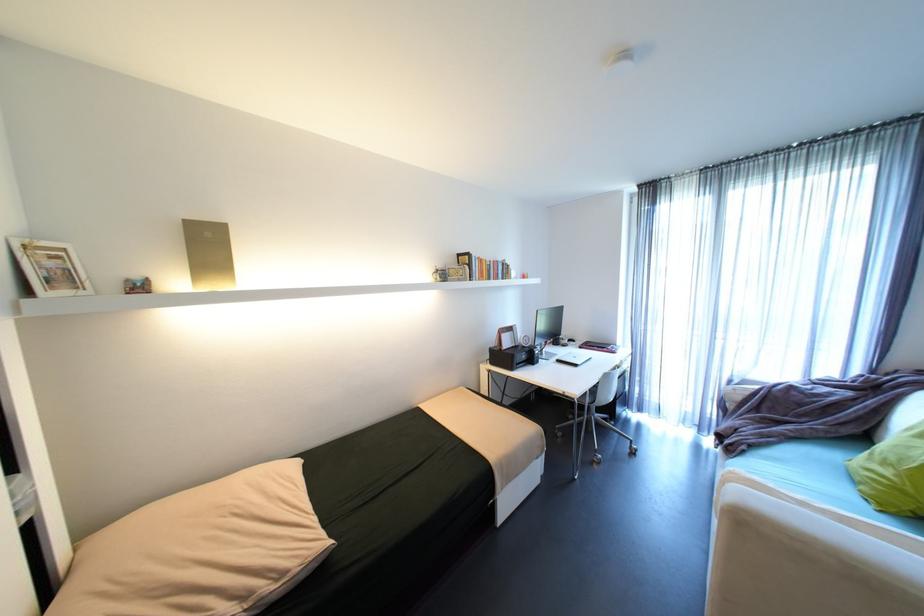
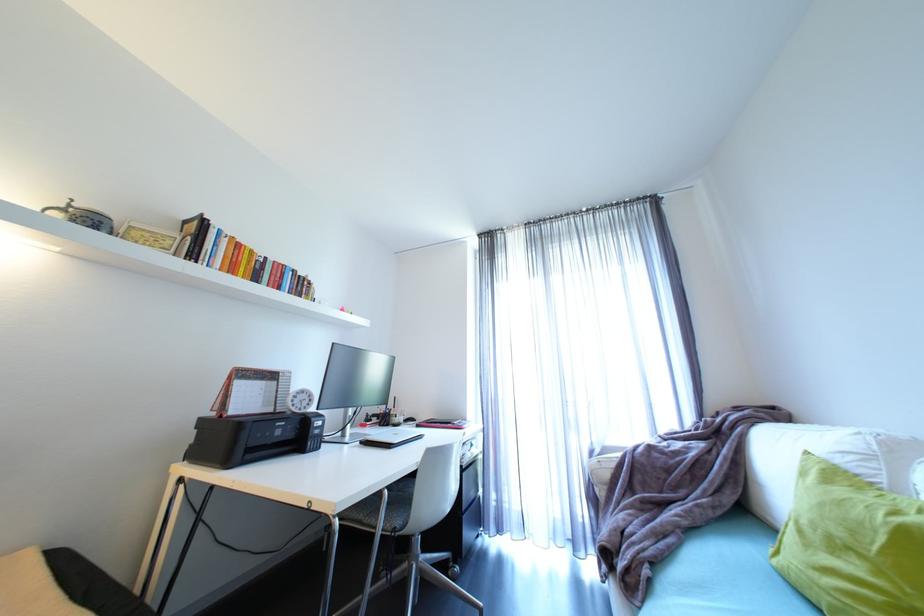
Find the pixel in the second image that matches the point at 442,270 in the first image.

(69, 206)